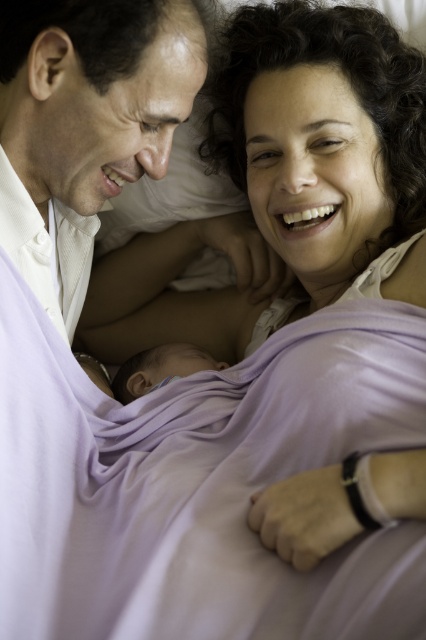
You are a photographer taking a picture of the scene. You want to focus on the point closer to the camera. Which point should you choose between point (104, 76) and point (161, 346)?

Point (104, 76) is closer to the camera than point (161, 346), so you should focus on point (104, 76).

You are a photographer who needs to adjust the lighting to ensure both the white satin shirt at upper left and the smooth purple blanket at center are well lit. Considering their positions and sizes, which object might require more direct light to avoid shadows?

The white satin shirt at upper left has a greater height compared to the smooth purple blanket at center, so it might require more direct light to avoid shadows since it is taller and could cast longer shadows.